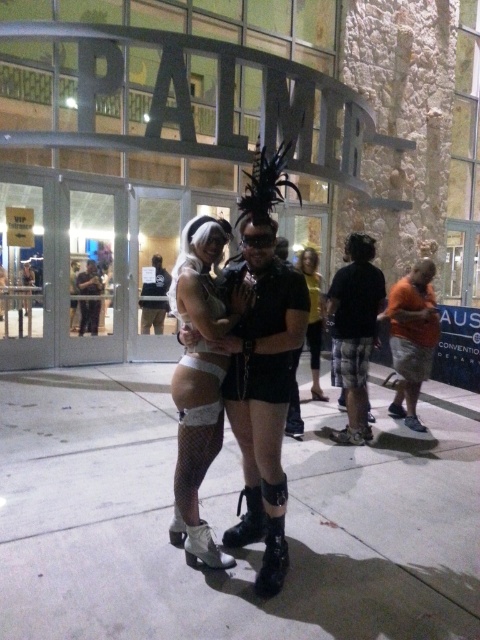
Does white fishnet stockings at center appear on the left side of matte black shorts at center?

Yes, white fishnet stockings at center is to the left of matte black shorts at center.

Who is more forward, (186,557) or (316,269)?

Positioned in front is point (186,557).

Where is `white fishnet stockings at center`? white fishnet stockings at center is located at coordinates (197, 385).

The width and height of the screenshot is (480, 640). Describe the element at coordinates (411, 337) in the screenshot. I see `orange cotton t-shirt at right` at that location.

This screenshot has width=480, height=640. What are the coordinates of `orange cotton t-shirt at right` in the screenshot? It's located at (411, 337).

Does white fishnet stockings at center have a larger size compared to black plaid shorts at center?

No.

You are a GUI agent. You are given a task and a screenshot of the screen. Output one action in this format:
    pyautogui.click(x=<x>, y=<y>)
    Task: Click on the white fishnet stockings at center
    The image size is (480, 640).
    Given the screenshot: What is the action you would take?
    point(197,385)

Is point (204, 525) closer to camera compared to point (379, 307)?

Yes, point (204, 525) is in front of point (379, 307).

Locate an element on the screen. Image resolution: width=480 pixels, height=640 pixels. white fishnet stockings at center is located at coordinates (197, 385).